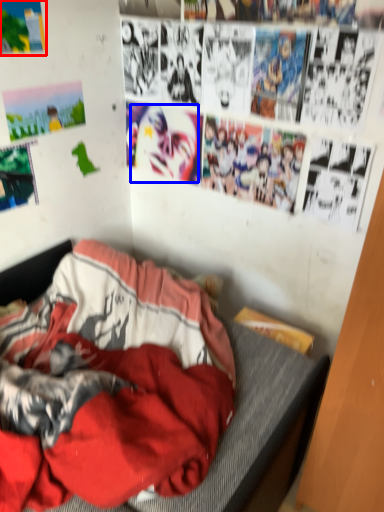
Question: Which object is closer to the camera taking this photo, poster page (highlighted by a red box) or person (highlighted by a blue box)?

Choices:
 (A) poster page
 (B) person

Answer: (A)